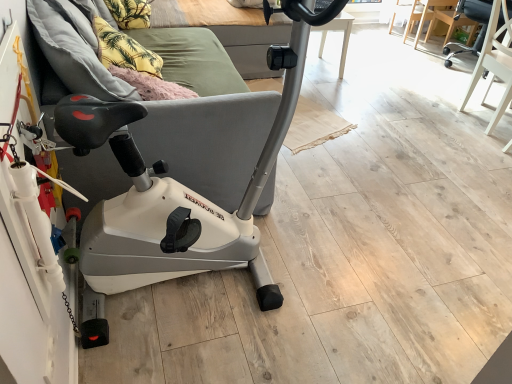
The width and height of the screenshot is (512, 384). What are the coordinates of `free point below black leather swivel chair at upper right, which is the 2th swivel chair in back-to-front order (from a real-world perspective)` in the screenshot? It's located at (480, 117).